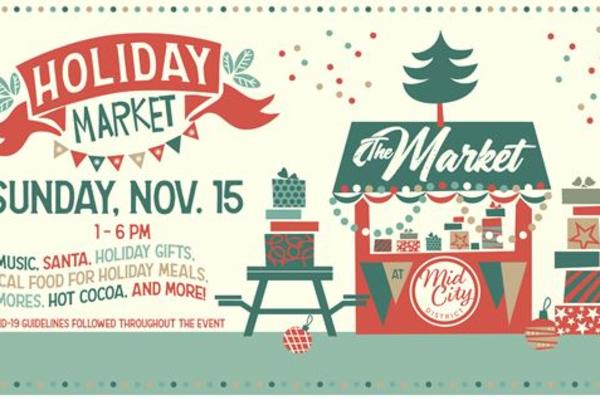
Where can where people would sit at table be observed in this image? Your answer should be formatted as a list of tuples, i.e. [(x1, y1), (x2, y2), ...], where each tuple contains the x and y coordinates of a point satisfying the conditions above.

[(228, 292), (354, 289)]